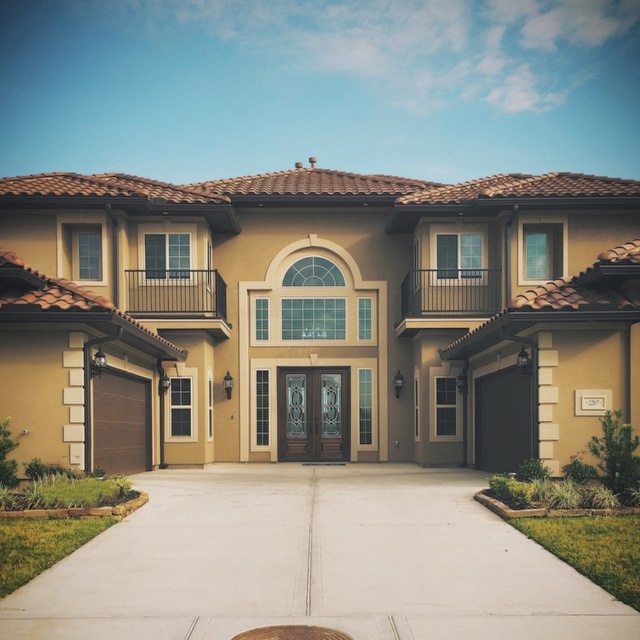
Question: Among these objects, which one is nearest to the camera?

Choices:
 (A) metallic gray manhole cover at center
 (B) concrete at center

Answer: (A)

Question: Which point appears closest to the camera in this image?

Choices:
 (A) (288, 625)
 (B) (547, 586)

Answer: (A)

Question: Which point is closer to the camera taking this photo?

Choices:
 (A) (289, 632)
 (B) (456, 548)

Answer: (A)

Question: Is concrete at center bigger than metallic gray manhole cover at center?

Choices:
 (A) no
 (B) yes

Answer: (B)

Question: From the image, what is the correct spatial relationship of concrete at center in relation to metallic gray manhole cover at center?

Choices:
 (A) below
 (B) above

Answer: (A)

Question: Can you confirm if concrete at center is thinner than metallic gray manhole cover at center?

Choices:
 (A) yes
 (B) no

Answer: (B)